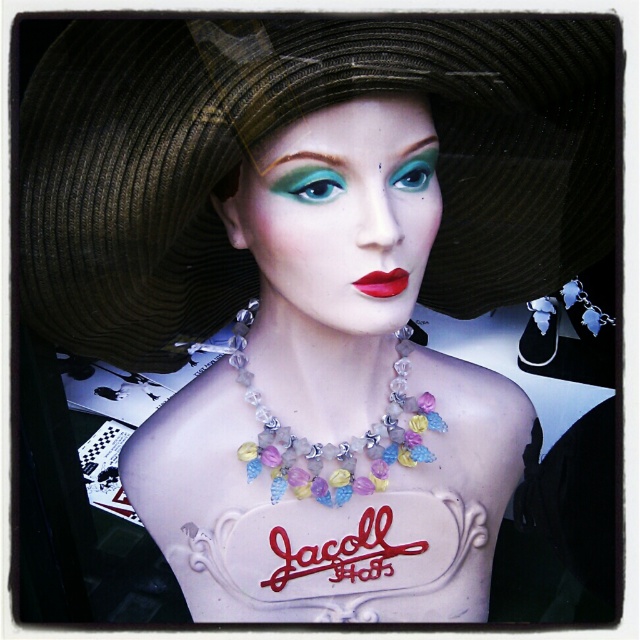
In the scene shown: Does pastel crystal necklace at center lie in front of matte red lipstick at center?

No, it is not.

At what (x,y) coordinates should I click in order to perform the action: click on pastel crystal necklace at center. Please return your answer as a coordinate pair (x, y). This screenshot has width=640, height=640. Looking at the image, I should click on (330, 442).

Can you confirm if brown straw hat at upper center is smaller than matte black hat at upper center?

Actually, brown straw hat at upper center might be larger than matte black hat at upper center.

Which of these two, brown straw hat at upper center or matte black hat at upper center, stands taller?

matte black hat at upper center is taller.

What do you see at coordinates (280, 128) in the screenshot? I see `brown straw hat at upper center` at bounding box center [280, 128].

What are the coordinates of `brown straw hat at upper center` in the screenshot? It's located at (280, 128).

Does matte teal eye at center appear under matte red lipstick at center?

Actually, matte teal eye at center is above matte red lipstick at center.

Does matte teal eye at center have a smaller size compared to matte red lipstick at center?

No, matte teal eye at center is not smaller than matte red lipstick at center.

Between point (307, 188) and point (371, 291), which one is positioned in front?

Point (307, 188)

At what (x,y) coordinates should I click in order to perform the action: click on matte teal eye at center. Please return your answer as a coordinate pair (x, y). The height and width of the screenshot is (640, 640). Looking at the image, I should click on (310, 182).